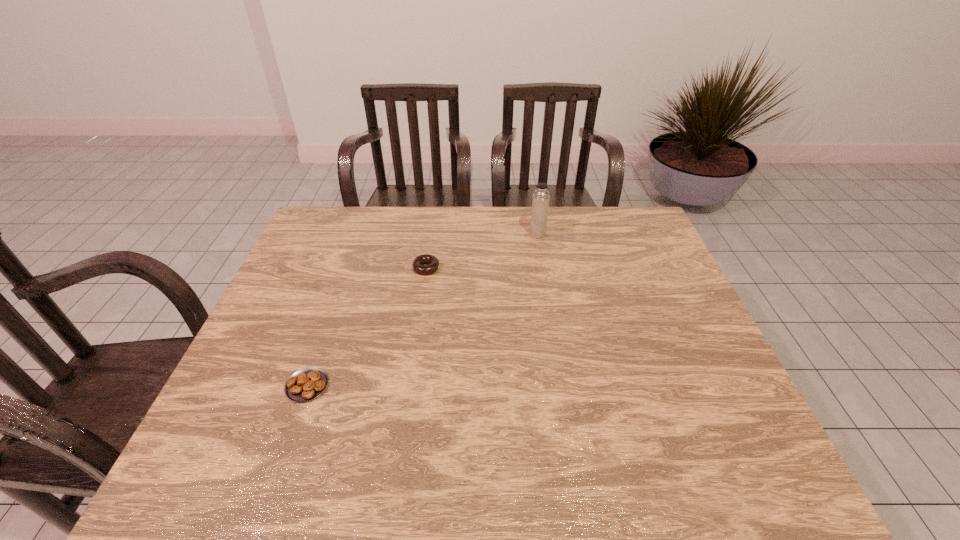
Where is `object located in the left edge section of the desktop`? object located in the left edge section of the desktop is located at coordinates (308, 383).

Where is `vacant area at the near edge`? vacant area at the near edge is located at coordinates click(294, 457).

At what (x,y) coordinates should I click in order to perform the action: click on vacant space at the left edge of the desktop. Please return your answer as a coordinate pair (x, y). Looking at the image, I should click on (281, 366).

In the image, there is a desktop. Where is `free space at the right edge`? The height and width of the screenshot is (540, 960). free space at the right edge is located at coordinates (684, 411).

Locate an element on the screen. vacant space at the far right corner of the desktop is located at coordinates (654, 242).

Identify the location of vacant point located between the thermos bottle and the second farthest object. The height and width of the screenshot is (540, 960). (482, 251).

The width and height of the screenshot is (960, 540). Find the location of `unoccupied position between the pastry and the second object from right to left`. unoccupied position between the pastry and the second object from right to left is located at coordinates (367, 327).

This screenshot has height=540, width=960. Identify the location of free space between the second nearest object and the pastry. (367, 327).

At what (x,y) coordinates should I click in order to perform the action: click on empty space between the nearest object and the tallest object. Please return your answer as a coordinate pair (x, y). The height and width of the screenshot is (540, 960). Looking at the image, I should click on (422, 310).

This screenshot has height=540, width=960. In order to click on empty space between the rightmost object and the leftmost object in this screenshot , I will do `click(422, 310)`.